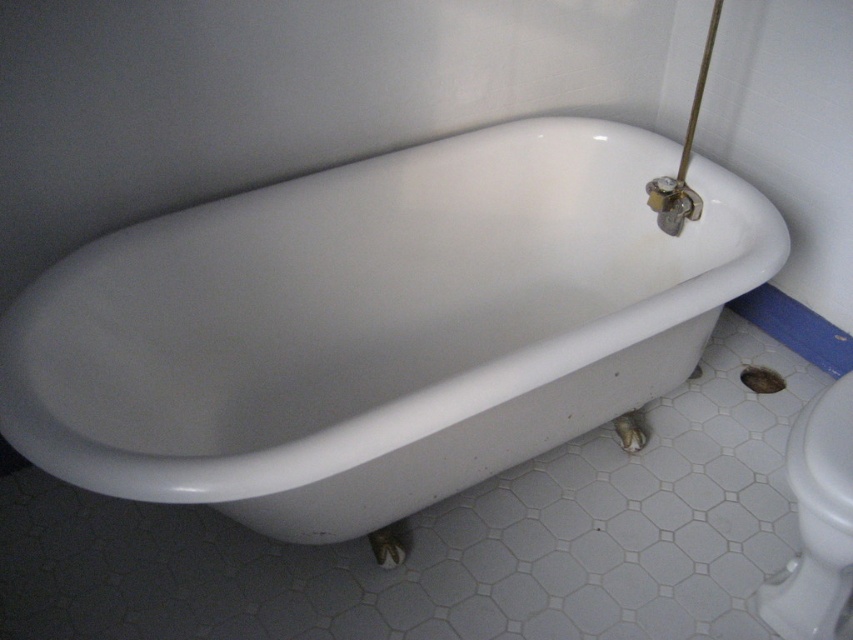
You are a plumber trying to replace the drain of the white glossy bathtub at center and the white glossy toilet bowl at lower right. You have a standard tool kit. Which object requires a larger drain opening?

The white glossy bathtub at center requires a larger drain opening because it is wider than the white glossy toilet bowl at lower right.

You are designing a bathroom layout and need to place both the white glossy bathtub at center and the white glossy toilet bowl at lower right. Given their sizes, which one should be placed closer to the wall to save space?

The white glossy toilet bowl at lower right should be placed closer to the wall to save space because it is smaller in size than the white glossy bathtub at center.